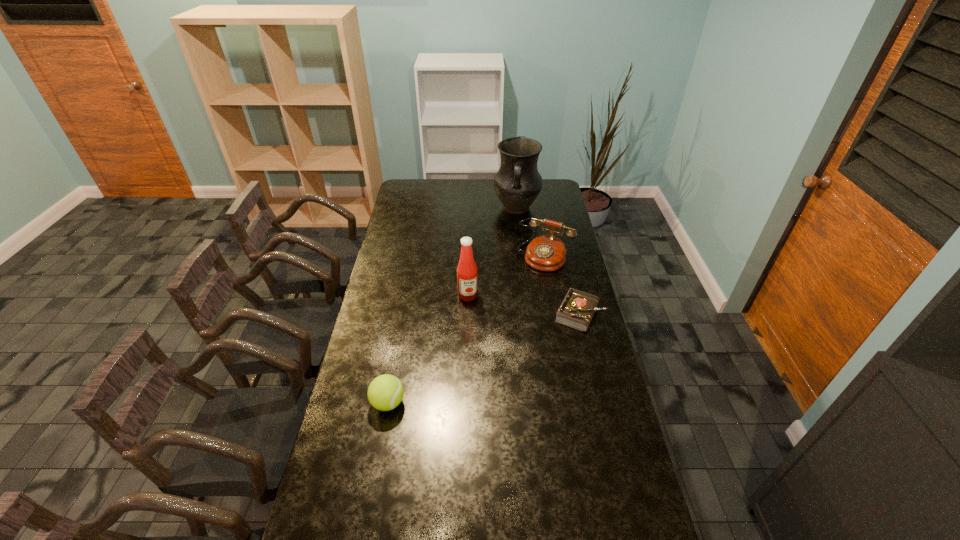
Find the location of a particular element. Image resolution: width=960 pixels, height=540 pixels. free spot between the second object from left to right and the tennis ball is located at coordinates [428, 349].

Locate which object ranks in proximity to the shortest object. Please provide its 2D coordinates. Your answer should be formatted as a tuple, i.e. [(x, y)], where the tuple contains the x and y coordinates of a point satisfying the conditions above.

[(546, 252)]

Identify the location of object that stands as the fourth closest to the shortest object. (385, 392).

Identify the location of free space that satisfies the following two spatial constraints: 1. on the back side of the third shortest object; 2. on the right side of the fourth shortest object. The height and width of the screenshot is (540, 960). (468, 256).

The image size is (960, 540). I want to click on free location that satisfies the following two spatial constraints: 1. on the back side of the shortest object; 2. on the left side of the tennis ball, so (404, 314).